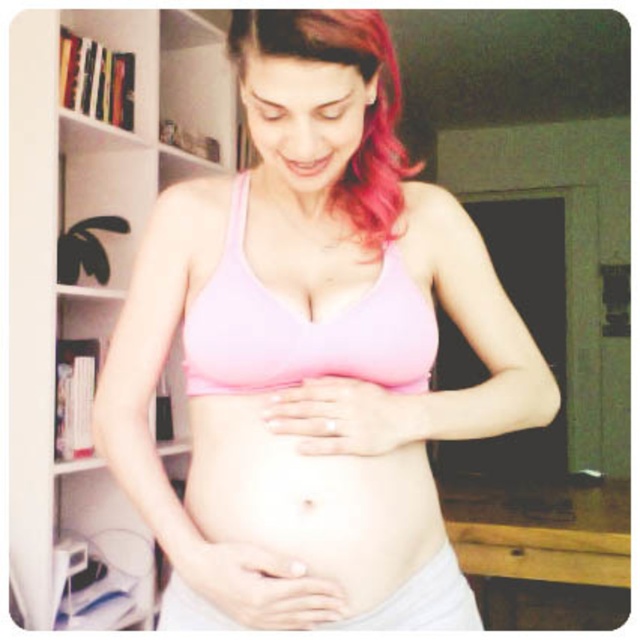
Question: In this image, where is white wooden bookshelf at left located relative to pink matte hair at upper center?

Choices:
 (A) below
 (B) above

Answer: (A)

Question: Which of the following is the closest to the observer?

Choices:
 (A) (352, 198)
 (B) (45, 88)

Answer: (A)

Question: Does white wooden bookshelf at left appear under matte pink bikini top at center?

Choices:
 (A) yes
 (B) no

Answer: (B)

Question: Which object appears farthest from the camera in this image?

Choices:
 (A) white wooden bookshelf at left
 (B) matte pink bikini top at center

Answer: (A)

Question: Which point is farther from the camera taking this photo?

Choices:
 (A) (356, 232)
 (B) (184, 502)
 (C) (33, 417)
 (D) (204, 365)

Answer: (C)

Question: Is the position of pink matte bra at center more distant than that of matte pink bikini top at center?

Choices:
 (A) yes
 (B) no

Answer: (B)